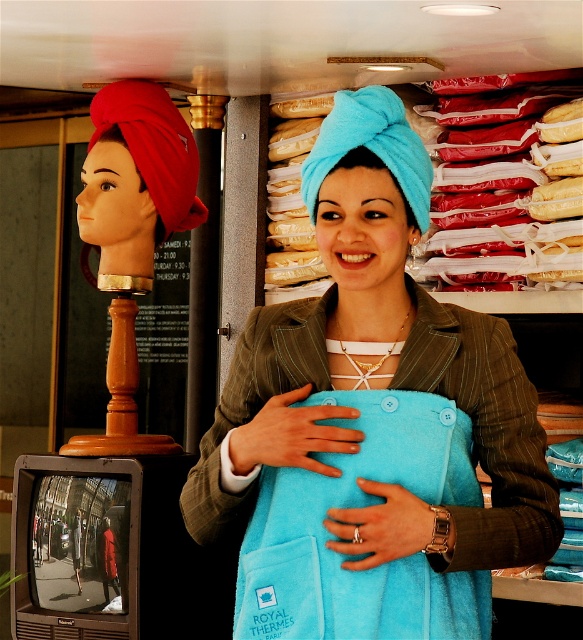
Can you confirm if turquoise fleece apron at center is positioned above red fabric head at left?

No.

Can you confirm if turquoise fleece apron at center is smaller than red fabric head at left?

Indeed, turquoise fleece apron at center has a smaller size compared to red fabric head at left.

Which is in front, point (307, 566) or point (107, 115)?

Point (307, 566) is in front.

Identify the location of turquoise fleece apron at center. This screenshot has width=583, height=640. (353, 556).

Based on the photo, is turquoise towel at center positioned before turquoise fleece apron at center?

That is True.

Does turquoise towel at center come behind turquoise fleece apron at center?

No, it is not.

Does point (233, 365) lie behind point (247, 602)?

Yes, point (233, 365) is farther from viewer.

I want to click on turquoise towel at center, so click(371, 422).

Which of these two, turquoise towel at center or red fabric head at left, stands shorter?

red fabric head at left

Locate an element on the screen. turquoise towel at center is located at coordinates (371, 422).

This screenshot has width=583, height=640. Identify the location of turquoise towel at center. (371, 422).